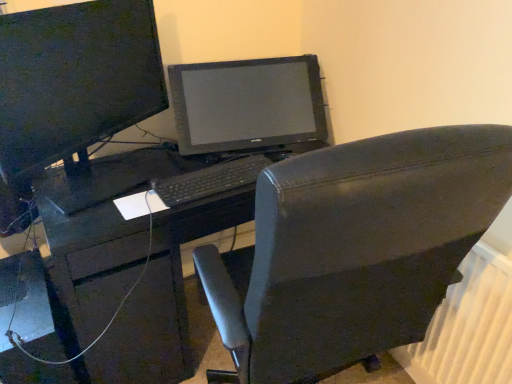
Question: Visually, is white plastic radiator at lower right positioned to the left or to the right of black plastic keyboard at center?

Choices:
 (A) left
 (B) right

Answer: (B)

Question: From the image's perspective, is white plastic radiator at lower right located above or below black plastic keyboard at center?

Choices:
 (A) below
 (B) above

Answer: (A)

Question: Which of these objects is positioned closest to the matte black desk at center?

Choices:
 (A) black plastic keyboard at center
 (B) white plastic radiator at lower right
 (C) black leather chair at center
 (D) matte black monitor at upper left

Answer: (A)

Question: Considering the real-world distances, which object is closest to the black leather chair at center?

Choices:
 (A) matte black desk at center
 (B) white plastic radiator at lower right
 (C) matte black monitor at upper left
 (D) black plastic keyboard at center

Answer: (B)